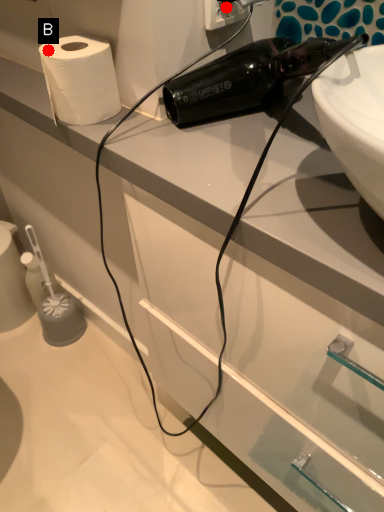
Question: Two points are circled on the image, labeled by A and B beside each circle. Which point is further to the camera?

Choices:
 (A) A is further
 (B) B is further

Answer: (A)